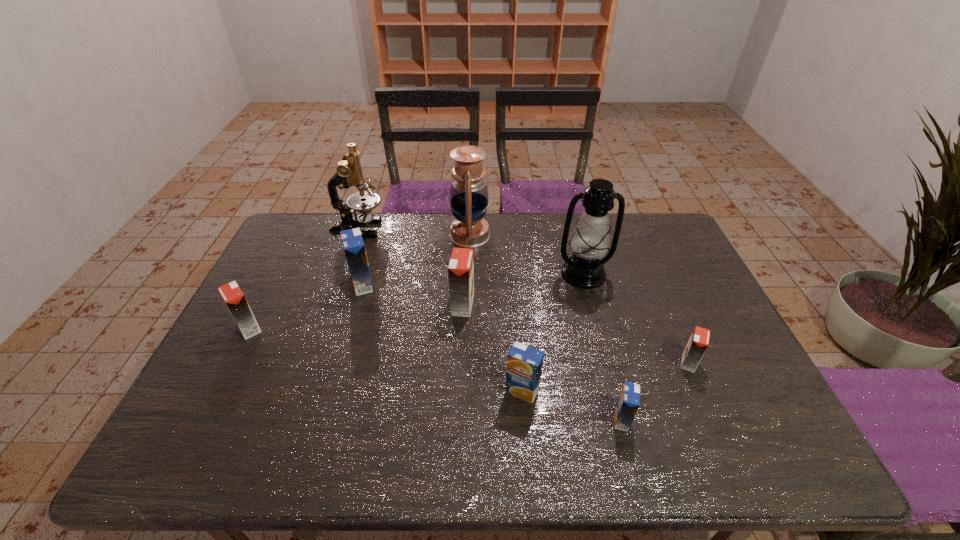
This screenshot has height=540, width=960. I want to click on microscope, so click(349, 172).

Where is `blue oil lamp`? blue oil lamp is located at coordinates (469, 197).

What are the coordinates of `the farther oil lamp` in the screenshot? It's located at (469, 197).

Image resolution: width=960 pixels, height=540 pixels. Identify the location of black oil lamp. (590, 241).

The image size is (960, 540). Identify the location of the right oil lamp. (590, 241).

Locate an element on the screen. the leftmost blue orange_juice is located at coordinates (353, 244).

The width and height of the screenshot is (960, 540). I want to click on the farthest blue orange_juice, so click(353, 244).

Identify the location of the biggest orange orange juice. [x=461, y=266].

At what (x,y) coordinates should I click in order to perform the action: click on the farthest orange orange juice. Please return your answer as a coordinate pair (x, y). The image size is (960, 540). Looking at the image, I should click on (461, 266).

The image size is (960, 540). I want to click on the second smallest orange orange juice, so click(232, 295).